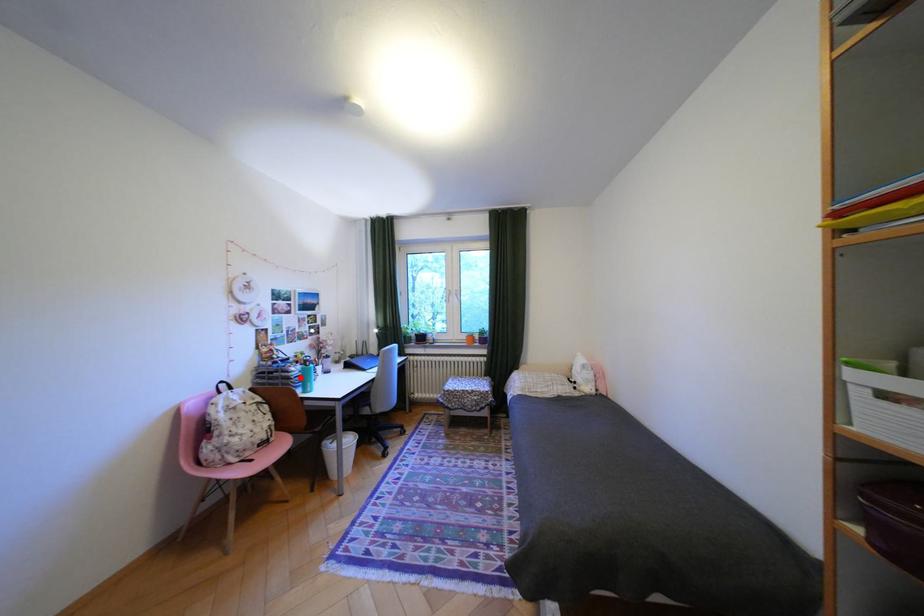
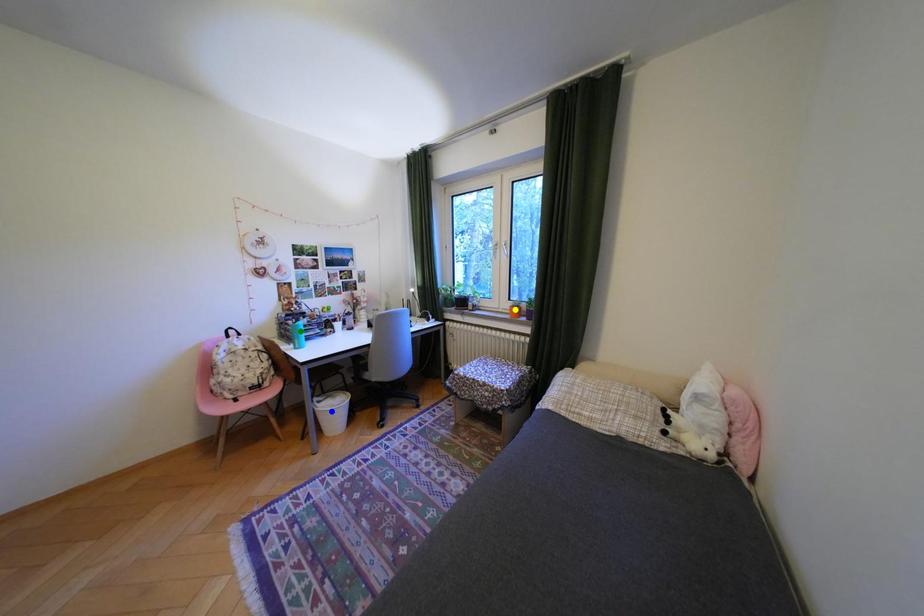
Question: I am providing you with two images of the same scene from different viewpoints. A red point is marked on the first image. You are given multiple points on the second image. Which mark in image 2 goes with the point in image 1?

Choices:
 (A) green point
 (B) yellow point
 (C) blue point

Answer: (A)